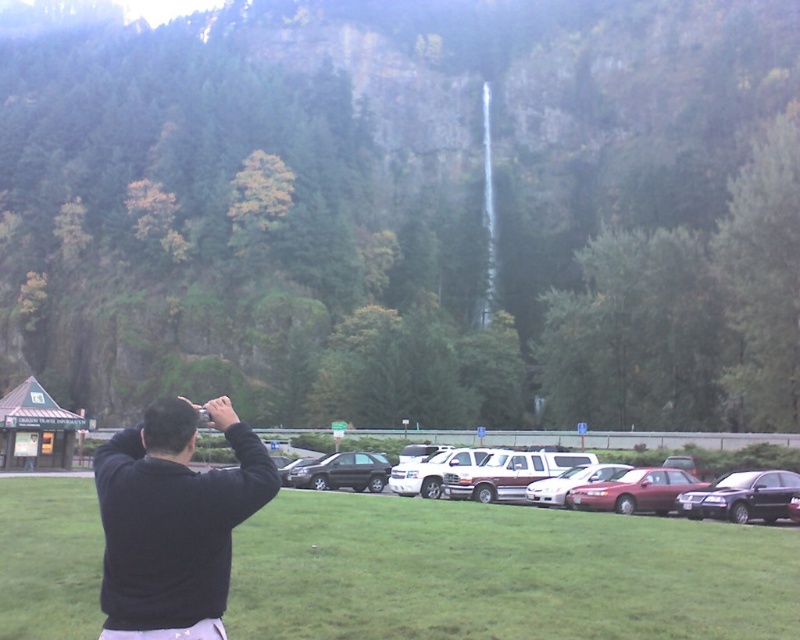
Question: Which object is farther from the camera taking this photo?

Choices:
 (A) metallic silver suv at center
 (B) satin black suv at center
 (C) shiny black sedan at lower right
 (D) metallic maroon sedan at center

Answer: (B)

Question: Does green grassy field at center appear under shiny silver sedan at center?

Choices:
 (A) yes
 (B) no

Answer: (B)

Question: Which object appears farthest from the camera in this image?

Choices:
 (A) black matte jacket at center
 (B) green grassy field at center

Answer: (B)

Question: Which point is closer to the camera?

Choices:
 (A) metallic silver suv at center
 (B) metallic maroon sedan at center

Answer: (A)

Question: Observing the image, what is the correct spatial positioning of green grassy field at center in reference to satin black suv at center?

Choices:
 (A) above
 (B) below

Answer: (A)

Question: Is green grassy field at center wider than satin black suv at center?

Choices:
 (A) no
 (B) yes

Answer: (B)